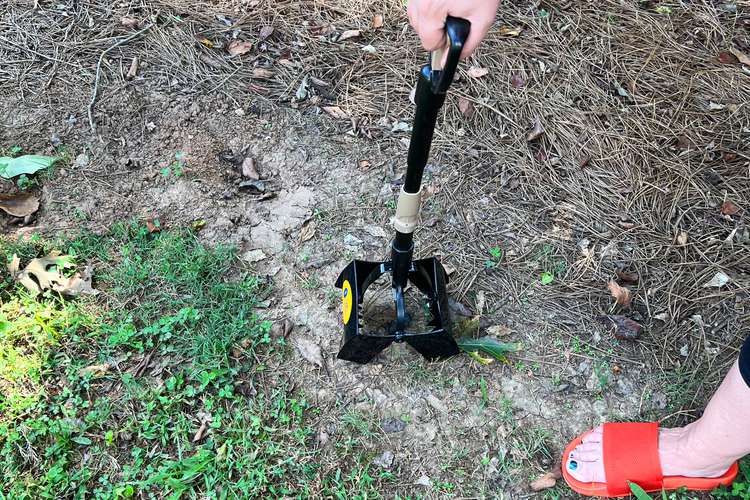
Locate an element on the screen. This screenshot has height=500, width=750. handle is located at coordinates (456, 48).